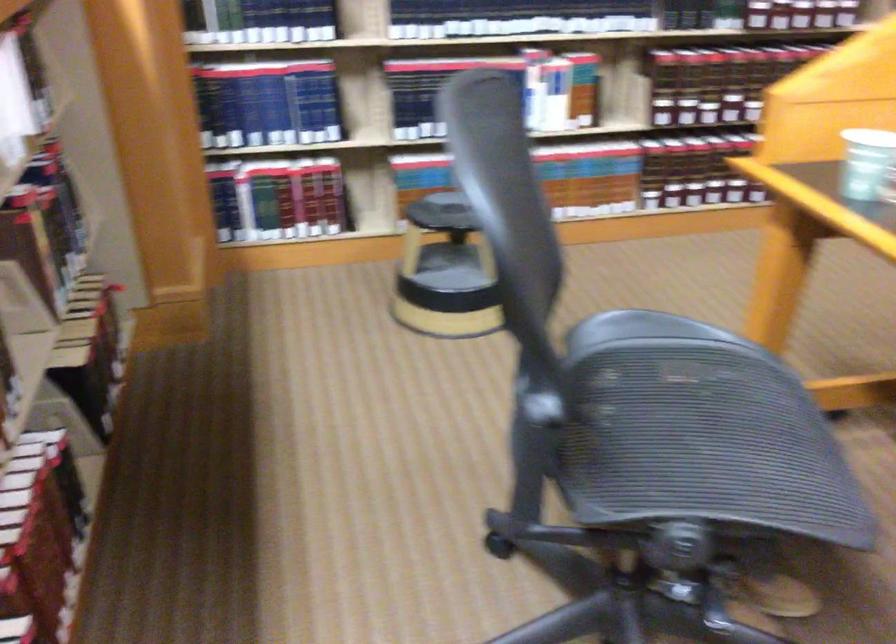
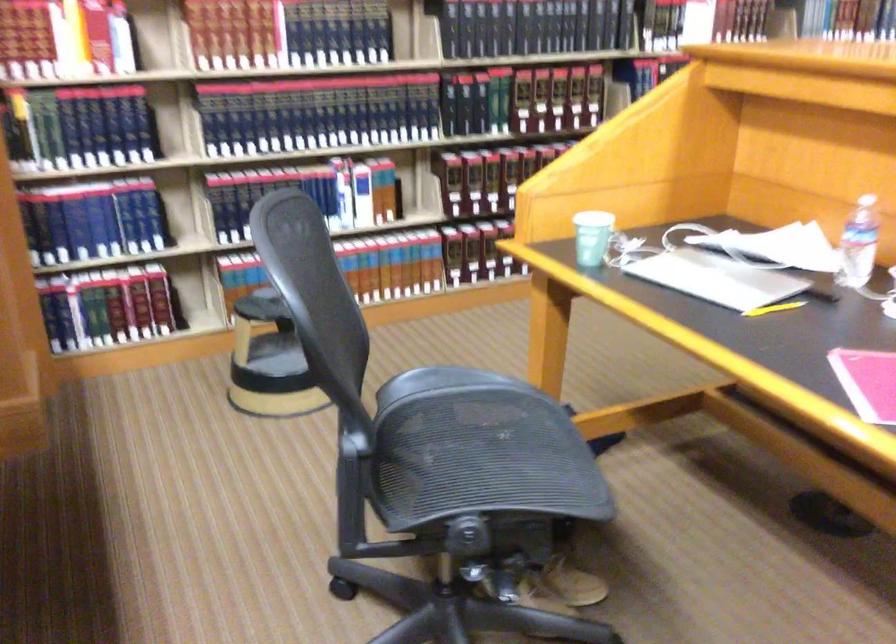
The point at [677,404] is marked in the first image. Where is the corresponding point in the second image?

(470, 442)